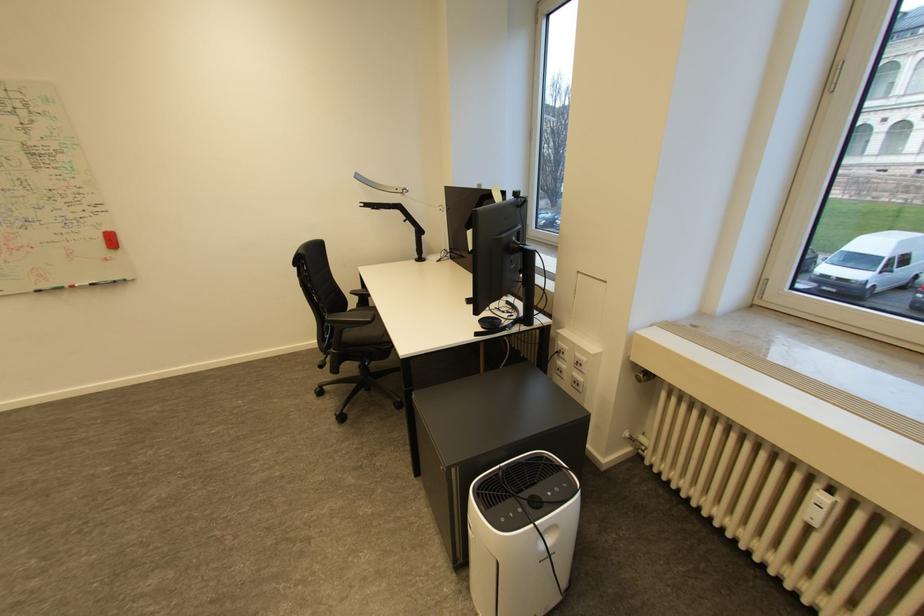
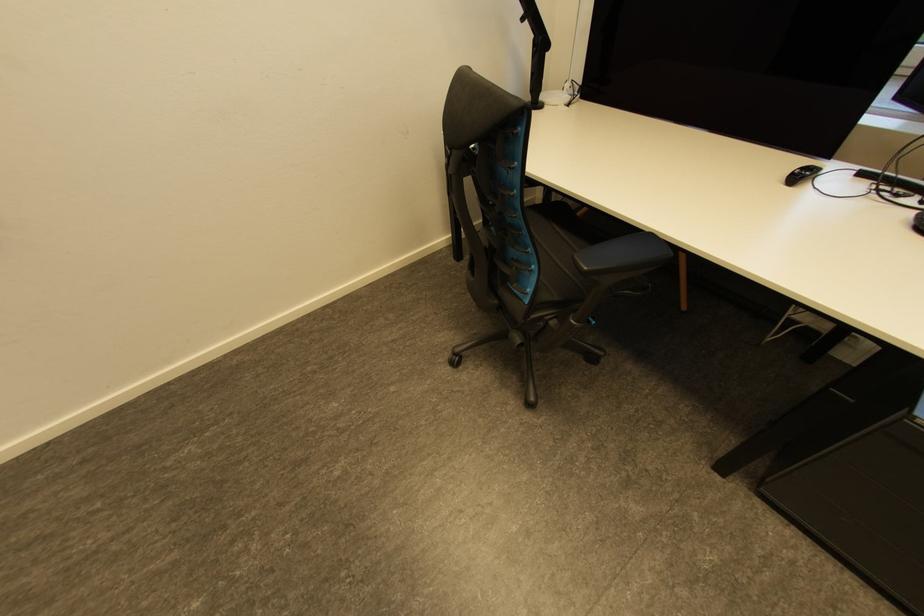
The images are taken continuously from a first-person perspective. In which direction are you moving?

The cameraman moved toward left, forward.